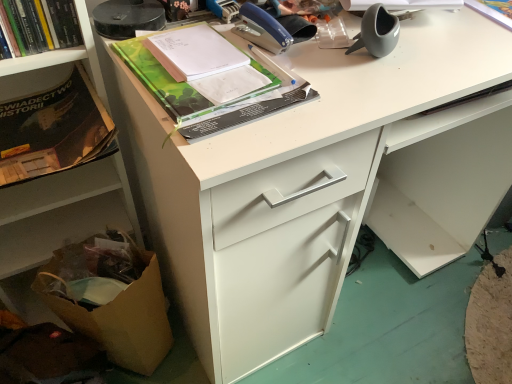
Locate an element on the screen. vacant space in front of blue plastic stapler at upper center, arranged as the second office supplies when viewed from the right is located at coordinates (279, 104).